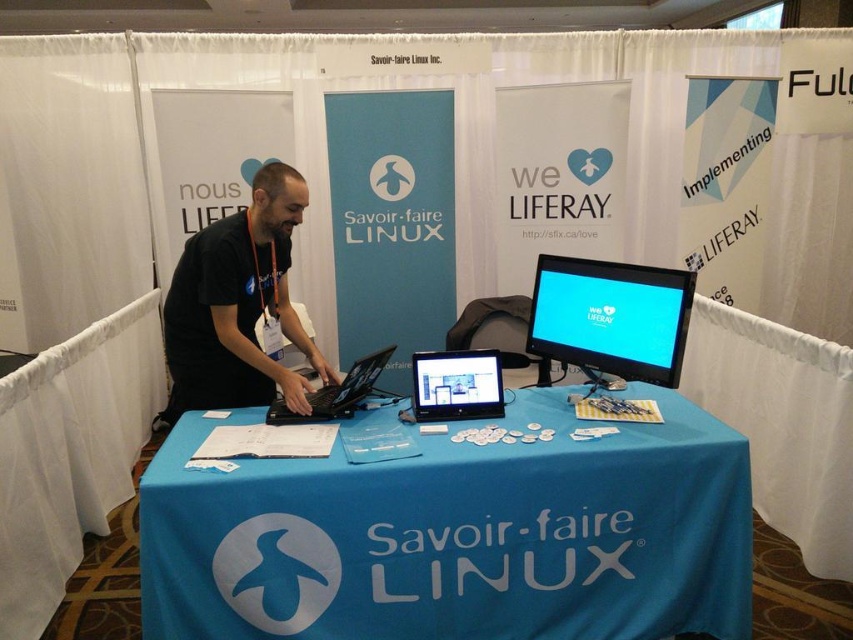
Question: Estimate the real-world distances between objects in this image. Which object is farther from the black matte laptop at center?

Choices:
 (A) satin black laptop at center
 (B) black fabric shirt at center

Answer: (B)

Question: Which object is the farthest from the black fabric shirt at center?

Choices:
 (A) matte black monitor at upper right
 (B) blue fabric tablecloth at center

Answer: (A)

Question: Does satin black laptop at center appear on the left side of black matte laptop at center?

Choices:
 (A) yes
 (B) no

Answer: (B)

Question: Which object appears farthest from the camera in this image?

Choices:
 (A) blue fabric tablecloth at center
 (B) satin black laptop at center

Answer: (B)

Question: Does satin black laptop at center appear over black matte laptop at center?

Choices:
 (A) no
 (B) yes

Answer: (B)

Question: Is blue fabric tablecloth at center below satin black laptop at center?

Choices:
 (A) no
 (B) yes

Answer: (B)